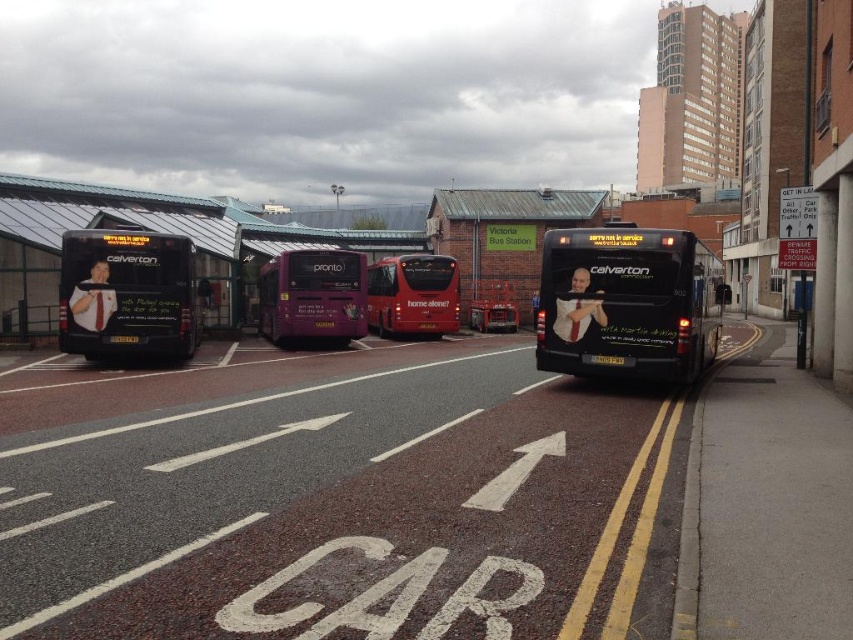
You are a photographer trying to capture the purple glossy bus at center and the black plastic license plate at rear in a single shot. Based on their sizes in the image, which object would appear smaller?

The purple glossy bus at center occupies less space than the black plastic license plate at rear, so it would appear smaller in the photo.

You are standing at the bus station and see a point marked at coordinates (x=628, y=301). What object is located at that point?

The point at coordinates (x=628, y=301) corresponds to the black matte bus at right.